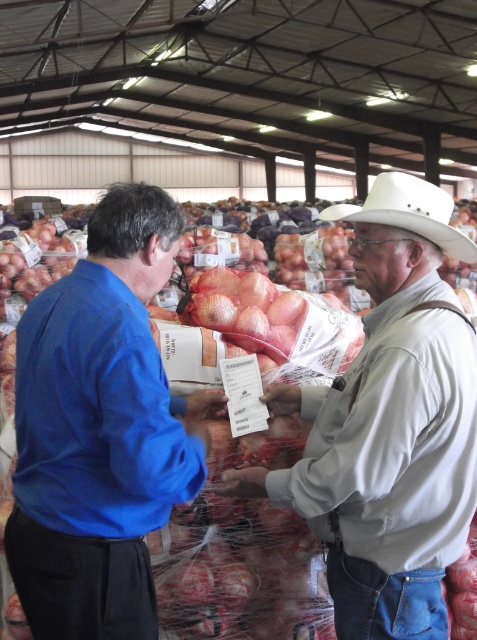
Question: Estimate the real-world distances between objects in this image. Which object is farther from the white matte cowboy hat at center?

Choices:
 (A) light gray cotton shirt at center
 (B) blue fabric shirt at left

Answer: (B)

Question: Does light gray cotton shirt at center appear on the right side of white matte cowboy hat at center?

Choices:
 (A) no
 (B) yes

Answer: (A)

Question: Is light gray cotton shirt at center smaller than white matte cowboy hat at center?

Choices:
 (A) yes
 (B) no

Answer: (B)

Question: Which object is the closest to the blue fabric shirt at left?

Choices:
 (A) white matte cowboy hat at center
 (B) light gray cotton shirt at center

Answer: (B)

Question: Which object is positioned closest to the blue fabric shirt at left?

Choices:
 (A) light gray cotton shirt at center
 (B) white matte cowboy hat at center

Answer: (A)

Question: Can you confirm if light gray cotton shirt at center is positioned to the left of white matte cowboy hat at center?

Choices:
 (A) yes
 (B) no

Answer: (A)